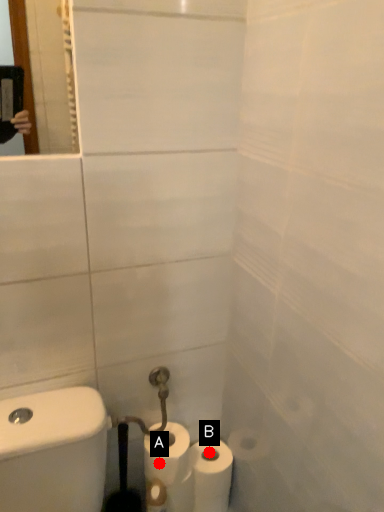
Question: Two points are circled on the image, labeled by A and B beside each circle. Which of the following is the farthest from the observer?

Choices:
 (A) A is further
 (B) B is further

Answer: (B)